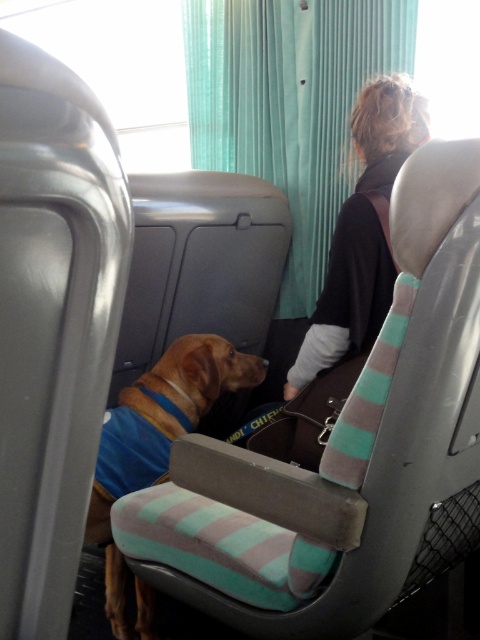
Between teal fabric curtain at upper center and dark brown hair at upper right, which one appears on the left side from the viewer's perspective?

From the viewer's perspective, teal fabric curtain at upper center appears more on the left side.

Is point (305, 84) farther from camera compared to point (368, 321)?

Yes.

Identify the location of teal fabric curtain at upper center. This screenshot has width=480, height=640. (289, 104).

Locate an element on the screen. Image resolution: width=480 pixels, height=640 pixels. teal fabric curtain at upper center is located at coordinates (289, 104).

Who is higher up, brown matte dog at center or striped fabric lap at center?

striped fabric lap at center is above.

The image size is (480, 640). Identify the location of brown matte dog at center. (156, 436).

What are the coordinates of `brown matte dog at center` in the screenshot? It's located at (156, 436).

Find the location of `dark brown hair at upper right`. dark brown hair at upper right is located at coordinates (361, 232).

Between dark brown hair at upper right and striped fabric lap at center, which one appears on the left side from the viewer's perspective?

striped fabric lap at center

The image size is (480, 640). What are the coordinates of `dark brown hair at upper right` in the screenshot? It's located at (361, 232).